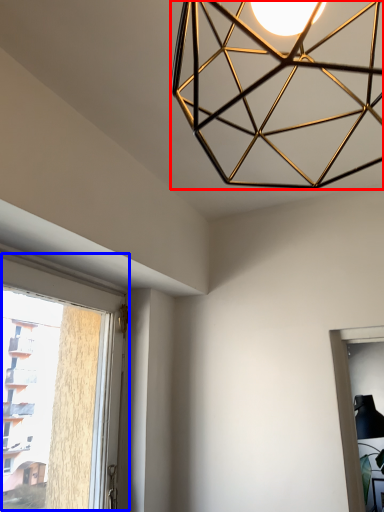
Question: Which object is further to the camera taking this photo, lamp (highlighted by a red box) or window (highlighted by a blue box)?

Choices:
 (A) lamp
 (B) window

Answer: (B)